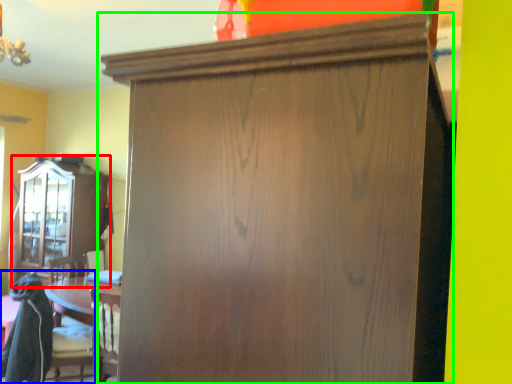
Question: Estimate the real-world distances between objects in this image. Which object is closer to cabinetry (highlighted by a red box), swivel chair (highlighted by a blue box) or cupboard (highlighted by a green box)?

Choices:
 (A) swivel chair
 (B) cupboard

Answer: (A)